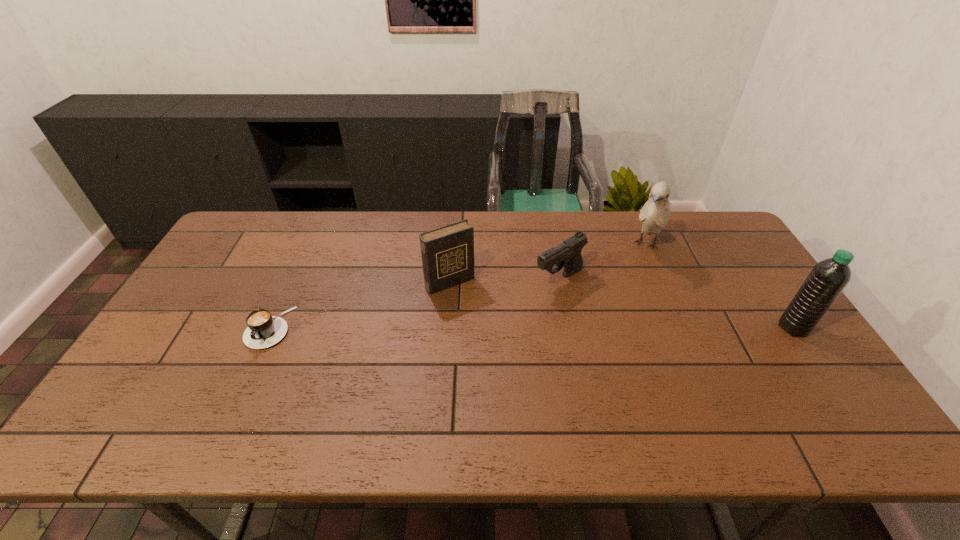
This screenshot has height=540, width=960. What are the coordinates of `vacant spot on the desktop that is between the cappuccino and the rightmost object and is positioned at the barrel of the second shortest object` in the screenshot? It's located at (485, 328).

The height and width of the screenshot is (540, 960). In order to click on vacant spot on the desktop that is between the leftmost object and the water bottle and is positioned on the front cover of the diary in this screenshot , I will do `click(482, 328)`.

The image size is (960, 540). What are the coordinates of `free space on the desktop that is between the shortest object and the rightmost object and is positioned at the beak of the second object from right to left` in the screenshot? It's located at (602, 328).